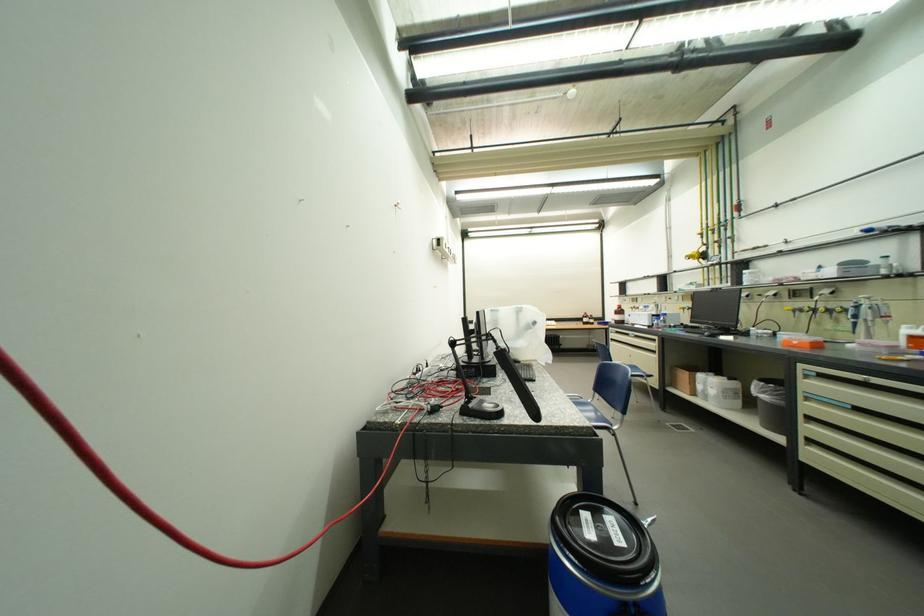
Where is `blue chair sitting surface`? This screenshot has width=924, height=616. blue chair sitting surface is located at coordinates (590, 411).